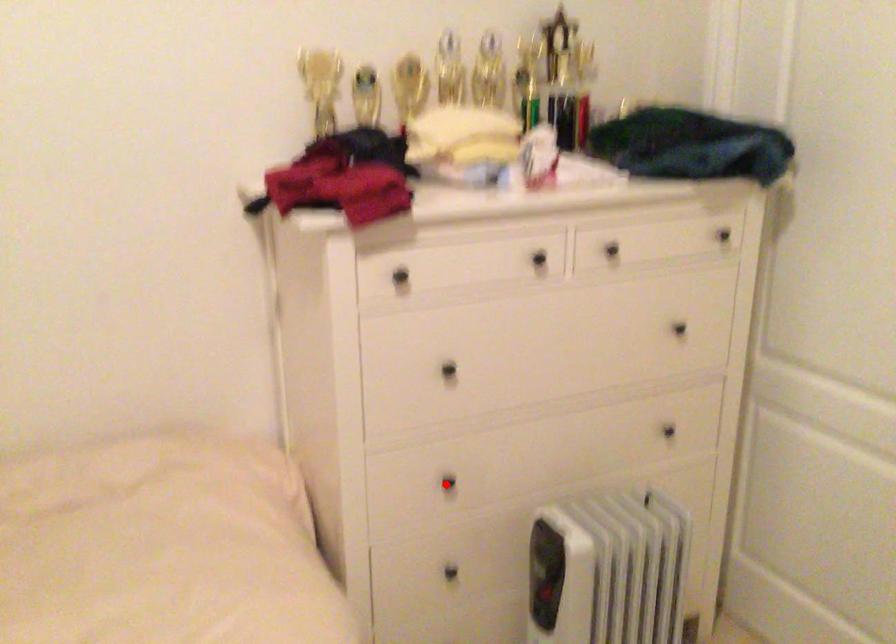
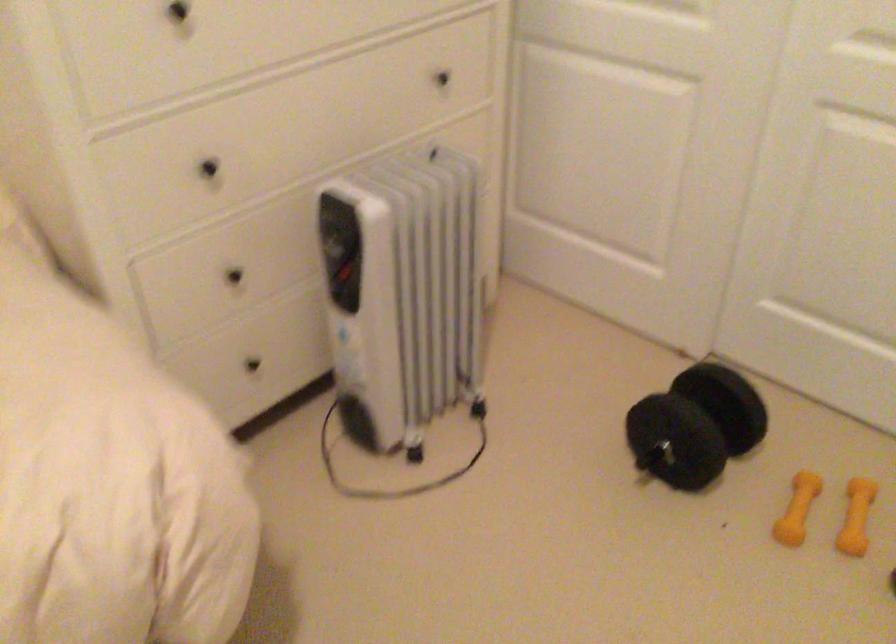
Question: A red point is marked in image1. In image2, is the corresponding 3D point closer to the camera or farther? Reply with the corresponding letter.

Choices:
 (A) The corresponding 3D point is closer.
 (B) The corresponding 3D point is farther.

Answer: (A)